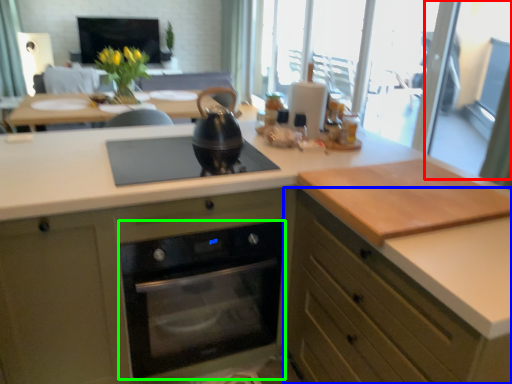
Question: Which is farther away from screen door (highlighted by a red box)? cabinetry (highlighted by a blue box) or home appliance (highlighted by a green box)?

Choices:
 (A) cabinetry
 (B) home appliance

Answer: (A)